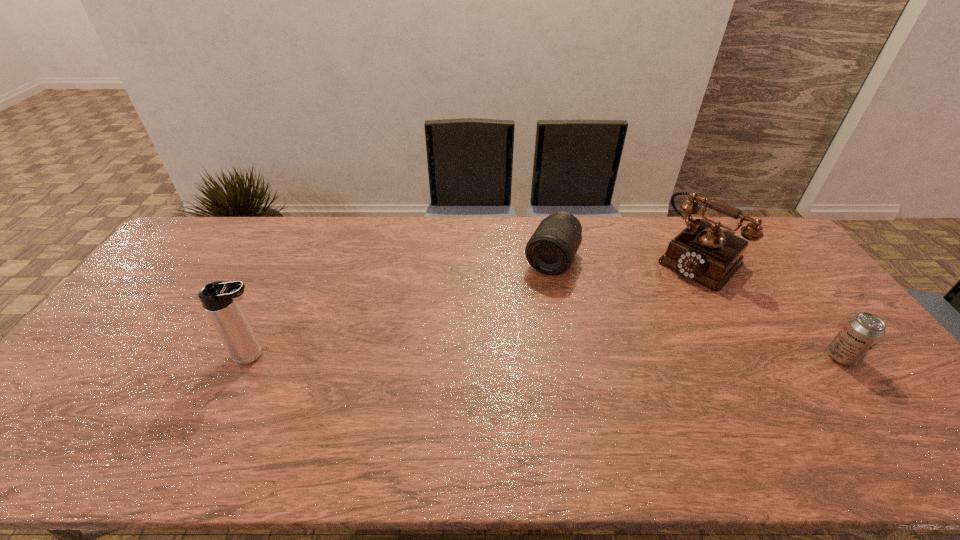
Locate an element on the screen. This screenshot has height=540, width=960. object that ranks as the second closest to the telephone is located at coordinates (551, 250).

Locate an element on the screen. The image size is (960, 540). the closest object to the telephone is located at coordinates (862, 332).

At what (x,y) coordinates should I click in order to perform the action: click on vacant space that satisfies the following two spatial constraints: 1. on the front side of the third object from left to right; 2. on the right side of the beer can. Please return your answer as a coordinate pair (x, y). Image resolution: width=960 pixels, height=540 pixels. Looking at the image, I should click on tap(755, 357).